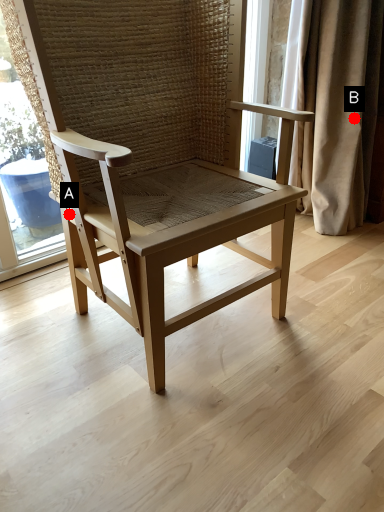
Question: Two points are circled on the image, labeled by A and B beside each circle. Among these points, which one is nearest to the camera?

Choices:
 (A) A is closer
 (B) B is closer

Answer: (A)